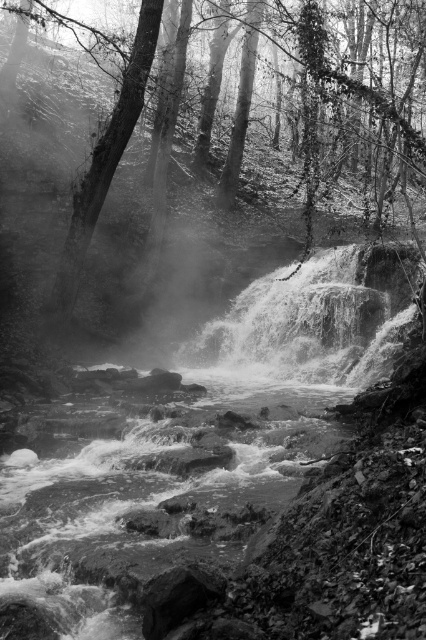
Question: Among these objects, which one is nearest to the camera?

Choices:
 (A) smooth bark tree at left
 (B) smooth bark tree at center

Answer: (B)

Question: Is smooth bark tree at center behind smooth bark tree at left?

Choices:
 (A) no
 (B) yes

Answer: (A)

Question: Does smooth bark tree at center come in front of smooth bark tree at left?

Choices:
 (A) no
 (B) yes

Answer: (B)

Question: Does smooth bark tree at center have a lesser width compared to smooth bark tree at left?

Choices:
 (A) no
 (B) yes

Answer: (A)

Question: Among these objects, which one is nearest to the camera?

Choices:
 (A) smooth bark tree at center
 (B) smooth bark tree at left

Answer: (A)